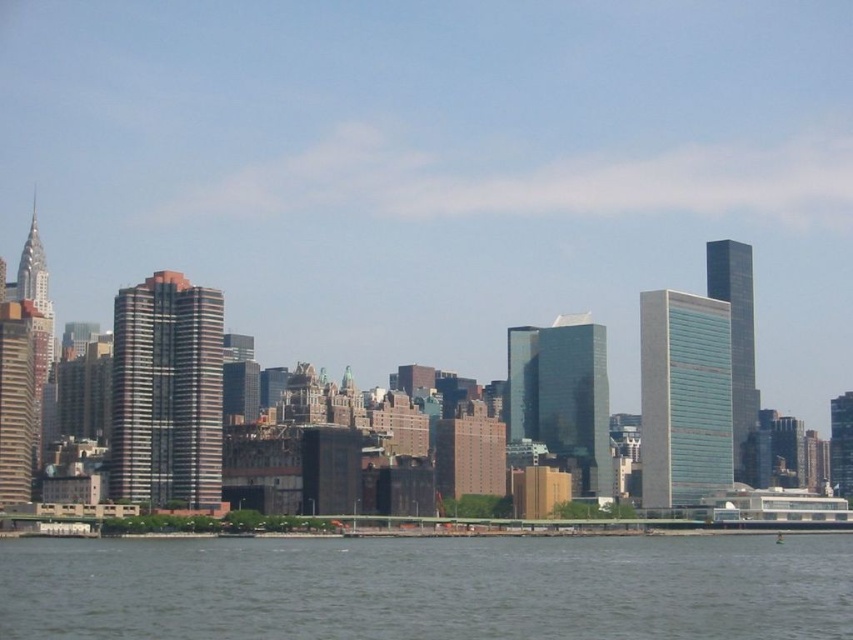
Does point (392, 556) come closer to viewer compared to point (836, 518)?

Yes, it is in front of point (836, 518).

Is gray water at lower center bigger than white glossy boat at lower right?

Yes, gray water at lower center is bigger than white glossy boat at lower right.

Is point (767, 563) positioned behind point (827, 516)?

No, (767, 563) is closer to viewer.

The height and width of the screenshot is (640, 853). In order to click on gray water at lower center in this screenshot , I will do `click(428, 588)`.